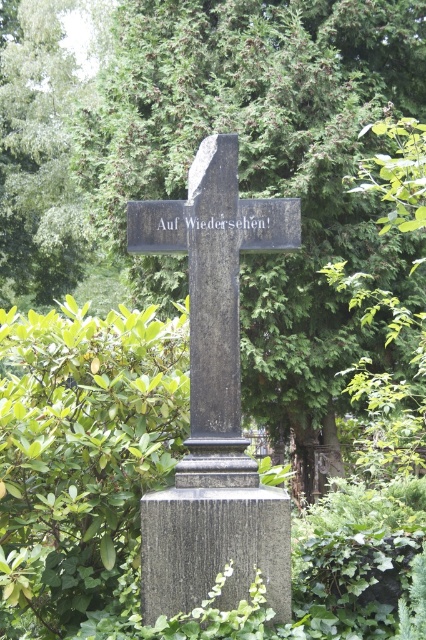
From the picture: Is green leafy tree at center positioned before black stone cross at center?

No, it is not.

In order to click on green leafy tree at center in this screenshot , I will do `click(267, 168)`.

Where is `green leafy tree at center`? green leafy tree at center is located at coordinates (267, 168).

The width and height of the screenshot is (426, 640). What are the coordinates of `green leafy tree at center` in the screenshot? It's located at (267, 168).

Who is positioned more to the left, black stone cross at center or granite gravestone at center?

From the viewer's perspective, black stone cross at center appears more on the left side.

Does point (204, 548) lie behind point (241, 547)?

That is False.

The height and width of the screenshot is (640, 426). I want to click on black stone cross at center, so click(213, 400).

Can you confirm if green leafy bush at center is shorter than black stone cross at center?

Yes, green leafy bush at center is shorter than black stone cross at center.

Who is shorter, green leafy bush at center or black stone cross at center?

With less height is green leafy bush at center.

The image size is (426, 640). Describe the element at coordinates (83, 449) in the screenshot. I see `green leafy bush at center` at that location.

Locate an element on the screen. This screenshot has width=426, height=640. green leafy bush at center is located at coordinates (83, 449).